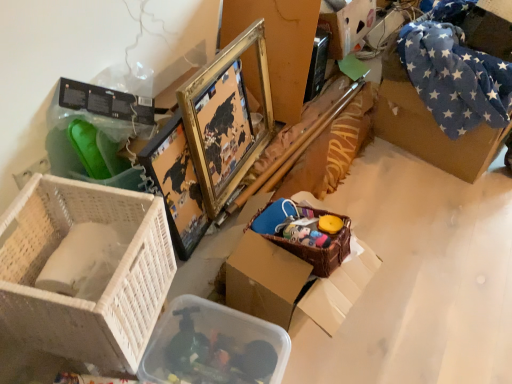
In order to face cardboard box at upper right, positioned as the 1th storage box in back-to-front order, should I rotate leftwards or rightwards?

Turn right by 9.785 degrees to look at cardboard box at upper right, positioned as the 1th storage box in back-to-front order.

Where is `white wicker basket at lower left`? white wicker basket at lower left is located at coordinates (84, 270).

In order to face translucent plastic container at lower center, the 2th storage box positioned from the back, should I rotate leftwards or rightwards?

To face it directly, rotate left by 6.291 degrees.

Identify the location of translucent plastic container at lower center, which is the 2th storage box from top to bottom. The width and height of the screenshot is (512, 384). (213, 346).

Image resolution: width=512 pixels, height=384 pixels. Find the location of `blue fleece blanket at upper right`. blue fleece blanket at upper right is located at coordinates (428, 126).

What is the approximate width of brown woven basket at lower right?

12.51 inches.

The width and height of the screenshot is (512, 384). In order to click on cardboard box at upper right, which is the 1th storage box from top to bottom in this screenshot , I will do `click(347, 25)`.

Can white wicker basket at lower left be found inside blue fleece blanket at upper right?

No, white wicker basket at lower left is located outside of blue fleece blanket at upper right.

Can you confirm if blue fleece blanket at upper right is smaller than white wicker basket at lower left?

Actually, blue fleece blanket at upper right might be larger than white wicker basket at lower left.

Considering the sizes of objects blue fleece blanket at upper right and white wicker basket at lower left in the image provided, who is wider, blue fleece blanket at upper right or white wicker basket at lower left?

blue fleece blanket at upper right.

Looking at this image, considering the positions of objects blue fleece blanket at upper right and white wicker basket at lower left in the image provided, who is behind, blue fleece blanket at upper right or white wicker basket at lower left?

Positioned behind is blue fleece blanket at upper right.

Considering the relative positions of translucent plastic container at lower center, the 2th storage box positioned from the back, and brown woven basket at lower right in the image provided, is translucent plastic container at lower center, the 2th storage box positioned from the back, to the left or to the right of brown woven basket at lower right?

In the image, translucent plastic container at lower center, the 2th storage box positioned from the back, appears on the left side of brown woven basket at lower right.

Looking at this image, from a real-world perspective, between translucent plastic container at lower center, marked as the 1th storage box in a front-to-back arrangement, and brown woven basket at lower right, who is vertically lower?

translucent plastic container at lower center, marked as the 1th storage box in a front-to-back arrangement, from a real-world perspective.

Looking at the image, does translucent plastic container at lower center, acting as the first storage box starting from the left, seem bigger or smaller compared to brown woven basket at lower right?

Considering their sizes, translucent plastic container at lower center, acting as the first storage box starting from the left, takes up more space than brown woven basket at lower right.

The image size is (512, 384). Find the location of `storage box that is below the brown woven basket at lower right (from the image's perspective)`. storage box that is below the brown woven basket at lower right (from the image's perspective) is located at coordinates tap(213, 346).

Which is closer, (481, 164) or (185, 104)?

Positioned in front is point (185, 104).

Is blue fleece blanket at upper right positioned far away from gold metallic picture frame at upper center?

Actually, blue fleece blanket at upper right and gold metallic picture frame at upper center are a little close together.

Is blue fleece blanket at upper right taller than gold metallic picture frame at upper center?

Incorrect, the height of blue fleece blanket at upper right is not larger of that of gold metallic picture frame at upper center.

Consider the image. What's the angular difference between blue fleece blanket at upper right and gold metallic picture frame at upper center's facing directions?

The angle between the facing direction of blue fleece blanket at upper right and the facing direction of gold metallic picture frame at upper center is 18.7 degrees.

Is white wicker basket at lower left facing towards blue fleece blanket at upper right?

No, white wicker basket at lower left is not facing towards blue fleece blanket at upper right.

How many degrees apart are the facing directions of white wicker basket at lower left and blue fleece blanket at upper right?

The angle between the facing direction of white wicker basket at lower left and the facing direction of blue fleece blanket at upper right is 30.9 degrees.

Is white wicker basket at lower left far from blue fleece blanket at upper right?

Yes.

Could you tell me if brown woven basket at lower right is facing cardboard box at upper right, which is the 1th storage box from top to bottom?

No, brown woven basket at lower right does not turn towards cardboard box at upper right, which is the 1th storage box from top to bottom.

From a real-world perspective, is brown woven basket at lower right above or below cardboard box at upper right, positioned as the 1th storage box in back-to-front order?

brown woven basket at lower right is below cardboard box at upper right, positioned as the 1th storage box in back-to-front order.

Can you confirm if brown woven basket at lower right is bigger than cardboard box at upper right, which is the 1th storage box from top to bottom?

Incorrect, brown woven basket at lower right is not larger than cardboard box at upper right, which is the 1th storage box from top to bottom.

From the image's perspective, would you say brown woven basket at lower right is shown under cardboard box at upper right, which is the 1th storage box from top to bottom?

Yes.

Is cardboard box at upper right, the second storage box when ordered from bottom to top, with brown woven basket at lower right?

cardboard box at upper right, the second storage box when ordered from bottom to top, and brown woven basket at lower right are clearly separated.

From a real-world perspective, is cardboard box at upper right, positioned as the 1th storage box in back-to-front order, located higher than brown woven basket at lower right?

Yes.

Which object is thinner, cardboard box at upper right, the second storage box when ordered from bottom to top, or brown woven basket at lower right?

brown woven basket at lower right.

Consider the image. Is cardboard box at upper right, which is the 1th storage box from top to bottom, positioned behind brown woven basket at lower right?

Yes, it is behind brown woven basket at lower right.

From a real-world perspective, which object stands above the other?

From a 3D spatial view, brown woven basket at lower right is above.

Is brown woven basket at lower right taller or shorter than translucent plastic container at lower center, placed as the 1th storage box when sorted from bottom to top?

Considering their sizes, brown woven basket at lower right has less height than translucent plastic container at lower center, placed as the 1th storage box when sorted from bottom to top.

Is brown woven basket at lower right inside the boundaries of translucent plastic container at lower center, placed as the 1th storage box when sorted from bottom to top, or outside?

brown woven basket at lower right is located beyond the bounds of translucent plastic container at lower center, placed as the 1th storage box when sorted from bottom to top.

The width and height of the screenshot is (512, 384). Identify the location of cardboard box below the white wicker basket at lower left (from a real-world perspective). (428, 126).

In order to click on basket above the translucent plastic container at lower center, placed as the 1th storage box when sorted from bottom to top (from a real-world perspective) in this screenshot , I will do 320,249.

Estimate the real-world distances between objects in this image. Which object is closer to translucent plastic container at lower center, acting as the first storage box starting from the left, cardboard box at upper right, the second storage box when ordered from bottom to top, or white wicker basket at lower left?

white wicker basket at lower left lies closer to translucent plastic container at lower center, acting as the first storage box starting from the left, than the other object.

Looking at the image, which one is located further to translucent plastic container at lower center, which is the 2th storage box from top to bottom, white wicker basket at lower left or gold metallic picture frame at upper center?

gold metallic picture frame at upper center.

Estimate the real-world distances between objects in this image. Which object is closer to brown woven basket at lower right, blue fleece blanket at upper right or cardboard box at upper right, the second storage box positioned from the left?

Among the two, blue fleece blanket at upper right is located nearer to brown woven basket at lower right.

From the image, which object appears to be nearer to translucent plastic container at lower center, which is the 2th storage box from top to bottom, brown woven basket at lower right or cardboard box at upper right, marked as the 1th storage box in a right-to-left arrangement?

brown woven basket at lower right.

When comparing their distances from translucent plastic container at lower center, marked as the 1th storage box in a front-to-back arrangement, does cardboard box at upper right, positioned as the 1th storage box in back-to-front order, or blue fleece blanket at upper right seem closer?

The object closer to translucent plastic container at lower center, marked as the 1th storage box in a front-to-back arrangement, is blue fleece blanket at upper right.

Considering their positions, is translucent plastic container at lower center, which is the 2th storage box from top to bottom, positioned further to white wicker basket at lower left than brown woven basket at lower right?

The object further to white wicker basket at lower left is brown woven basket at lower right.

Based on their spatial positions, is blue fleece blanket at upper right or white wicker basket at lower left closer to brown woven basket at lower right?

The object closer to brown woven basket at lower right is white wicker basket at lower left.

Considering their positions, is translucent plastic container at lower center, arranged as the 2th storage box when viewed from the right, positioned closer to gold metallic picture frame at upper center than brown woven basket at lower right?

brown woven basket at lower right is positioned closer to the anchor gold metallic picture frame at upper center.

Where is `basket between gold metallic picture frame at upper center and blue fleece blanket at upper right in the horizontal direction`? The height and width of the screenshot is (384, 512). basket between gold metallic picture frame at upper center and blue fleece blanket at upper right in the horizontal direction is located at coordinates (320, 249).

Locate an element on the screen. picture frame between white wicker basket at lower left and cardboard box at upper right, which is the 1th storage box from top to bottom, along the z-axis is located at coordinates (225, 118).

Locate an element on the screen. basket between white wicker basket at lower left and blue fleece blanket at upper right in the horizontal direction is located at coordinates (320, 249).

Find the location of a particular element. storage box situated between gold metallic picture frame at upper center and blue fleece blanket at upper right from left to right is located at coordinates (347, 25).